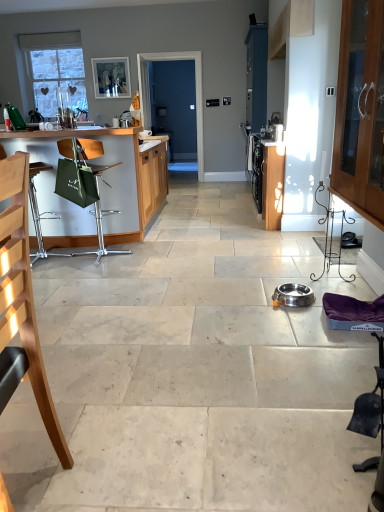
Where is `free space between black fabric swivel chair at lower right and stainless steel bowl at center`? The height and width of the screenshot is (512, 384). free space between black fabric swivel chair at lower right and stainless steel bowl at center is located at coordinates (313, 361).